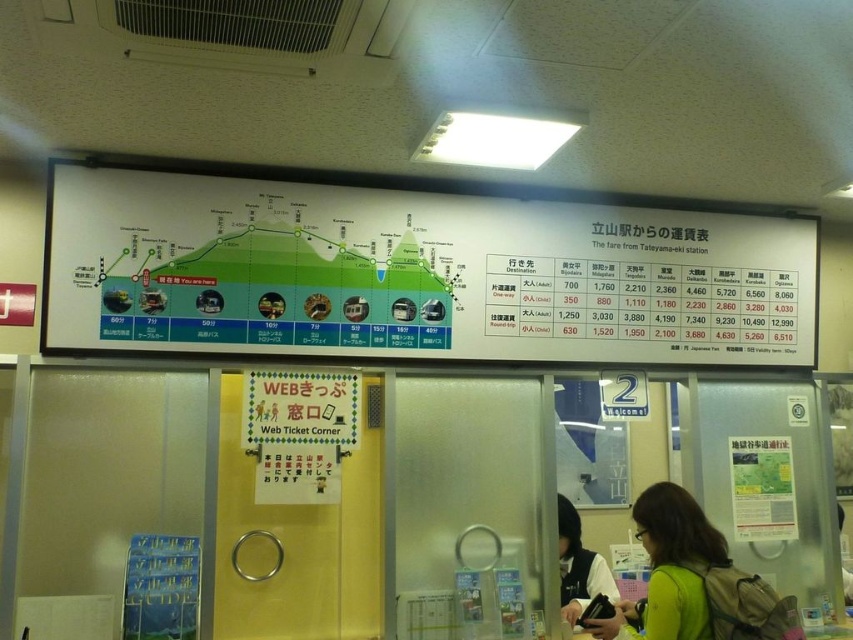
Question: Does white paper at upper center have a larger size compared to matte black jacket at lower right?

Choices:
 (A) no
 (B) yes

Answer: (B)

Question: Considering the real-world distances, which object is farthest from the green fabric jacket at lower right?

Choices:
 (A) matte black jacket at lower right
 (B) white paper at upper center

Answer: (B)

Question: Is green fabric jacket at lower right closer to the viewer compared to matte black jacket at lower right?

Choices:
 (A) yes
 (B) no

Answer: (A)

Question: Among these objects, which one is nearest to the camera?

Choices:
 (A) matte black jacket at lower right
 (B) white paper at upper center

Answer: (B)

Question: Which point is farther to the camera?

Choices:
 (A) (718, 548)
 (B) (454, 288)

Answer: (B)

Question: Can you confirm if white paper at upper center is thinner than matte black jacket at lower right?

Choices:
 (A) no
 (B) yes

Answer: (A)